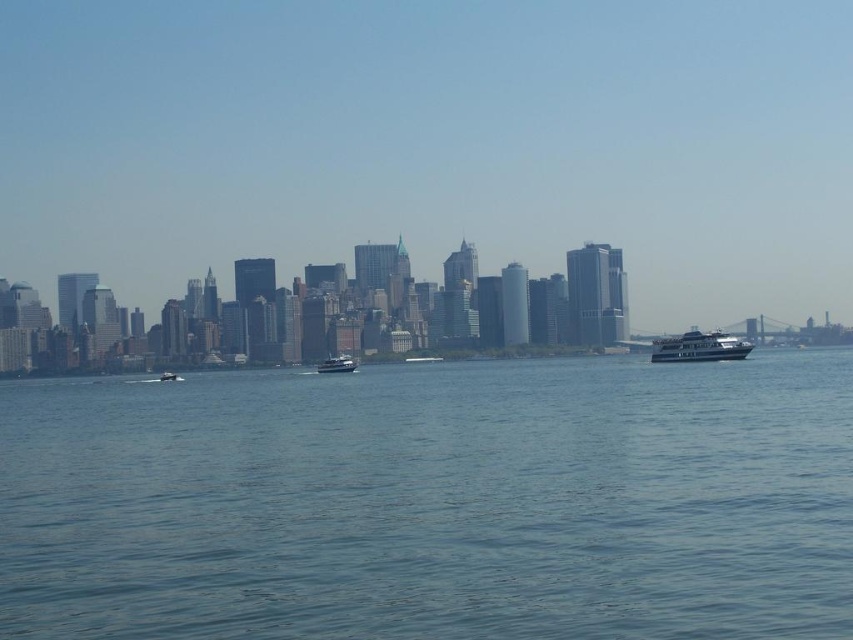
Question: Which of these objects is positioned closest to the white glossy ferry at right?

Choices:
 (A) metallic silver boat at center
 (B) blue water at center

Answer: (B)

Question: Which is nearer to the metallic silver boat at center?

Choices:
 (A) white glossy ferry at right
 (B) blue water at center
 (C) metallic silver boat at center-left

Answer: (C)

Question: Is white glossy ferry at right positioned at the back of metallic silver boat at center?

Choices:
 (A) no
 (B) yes

Answer: (A)

Question: Is white glossy ferry at right further to camera compared to metallic silver boat at center-left?

Choices:
 (A) yes
 (B) no

Answer: (B)

Question: Which is nearer to the metallic silver boat at center-left?

Choices:
 (A) metallic silver boat at center
 (B) white glossy ferry at right
 (C) blue water at center

Answer: (A)

Question: Is white glossy ferry at right behind metallic silver boat at center?

Choices:
 (A) yes
 (B) no

Answer: (B)